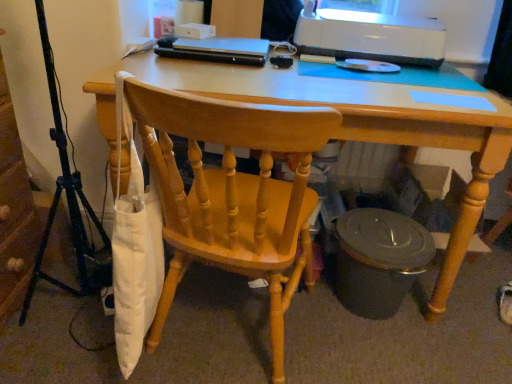
Identify the location of vacant region above matte black trash can at lower right (from a real-world perspective). (382, 228).